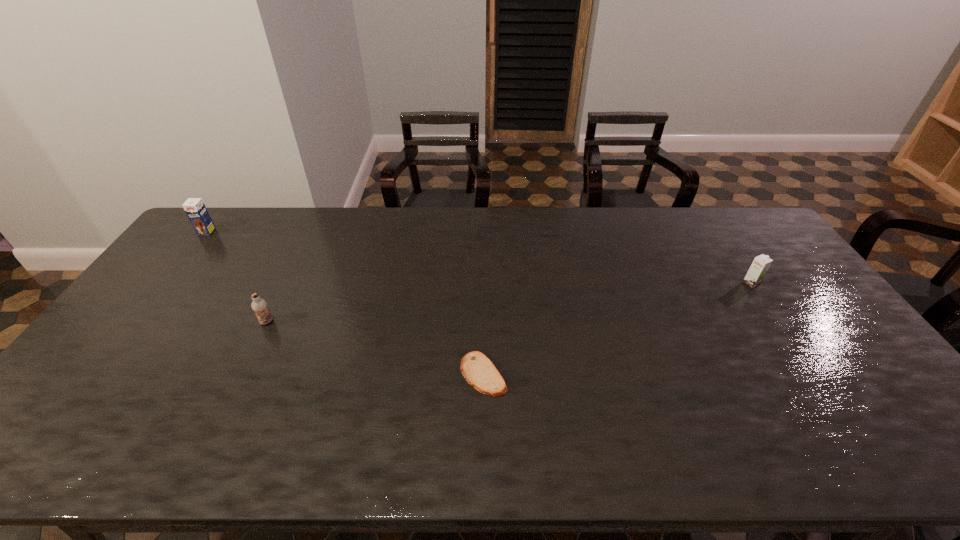
This screenshot has height=540, width=960. I want to click on vacant space located on the back of the rightmost chocolate milk, so click(721, 239).

Locate an element on the screen. vacant space positioned on the front of the pita bread is located at coordinates (484, 447).

The width and height of the screenshot is (960, 540). Find the location of `object that is at the far edge`. object that is at the far edge is located at coordinates (195, 209).

The image size is (960, 540). I want to click on object at the left edge, so click(195, 209).

The width and height of the screenshot is (960, 540). I want to click on object positioned at the right edge, so click(x=758, y=269).

Locate an element on the screen. The width and height of the screenshot is (960, 540). object present at the far left corner is located at coordinates (195, 209).

The width and height of the screenshot is (960, 540). What are the coordinates of `vacant space at the far edge of the desktop` in the screenshot? It's located at (347, 246).

Identify the location of vacant position at the near edge of the desktop. (618, 436).

In order to click on blank space at the left edge of the desktop in this screenshot , I will do `click(164, 301)`.

The image size is (960, 540). In the image, there is a desktop. Identify the location of blank space at the right edge. (881, 392).